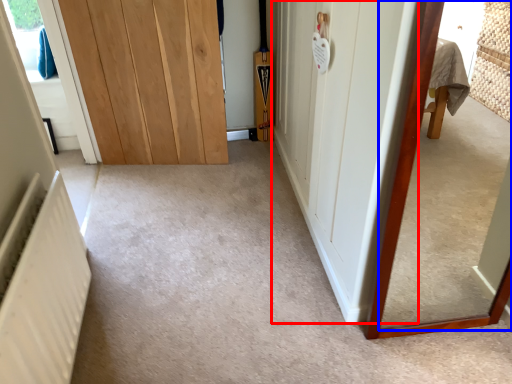
Question: Which point is closer to the camera, door (highlighted by a red box) or mirror (highlighted by a blue box)?

Choices:
 (A) door
 (B) mirror

Answer: (B)